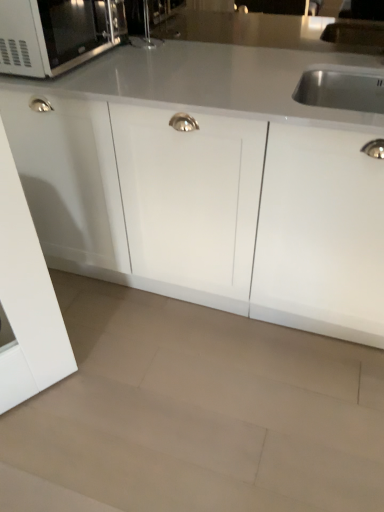
What are the coordinates of `free spot above beige polished granite at lower center (from a real-world perspective)` in the screenshot? It's located at (175, 398).